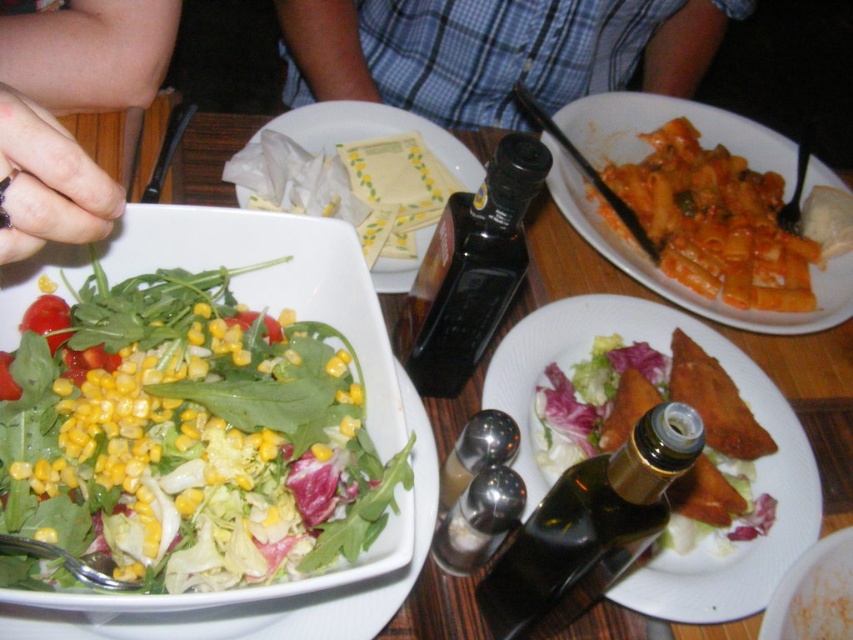
Question: Which object is closer to the camera taking this photo?

Choices:
 (A) matte glass plate at center
 (B) black glass bottle at center

Answer: (B)

Question: Which point is farther to the camera?

Choices:
 (A) (22, 472)
 (B) (845, 564)
 (C) (582, 83)
 (D) (473, 212)

Answer: (C)

Question: Does matte glass plate at center lie behind golden brown bread at center?

Choices:
 (A) yes
 (B) no

Answer: (B)

Question: Which object is closer to the camera taking this photo?

Choices:
 (A) matte glass plate at center
 (B) tomato-based pasta at center
 (C) black glass bottle at center

Answer: (C)

Question: Can you confirm if green leafy salad at center is bigger than dark brown glass bottle at center?

Choices:
 (A) no
 (B) yes

Answer: (B)

Question: Can you confirm if green leafy salad at center is thinner than matte glass plate at center?

Choices:
 (A) yes
 (B) no

Answer: (A)